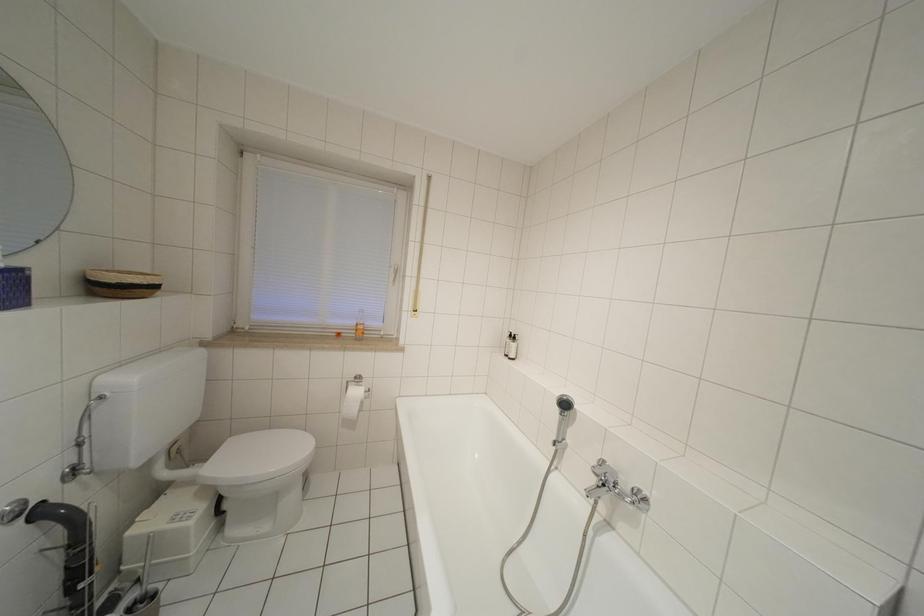
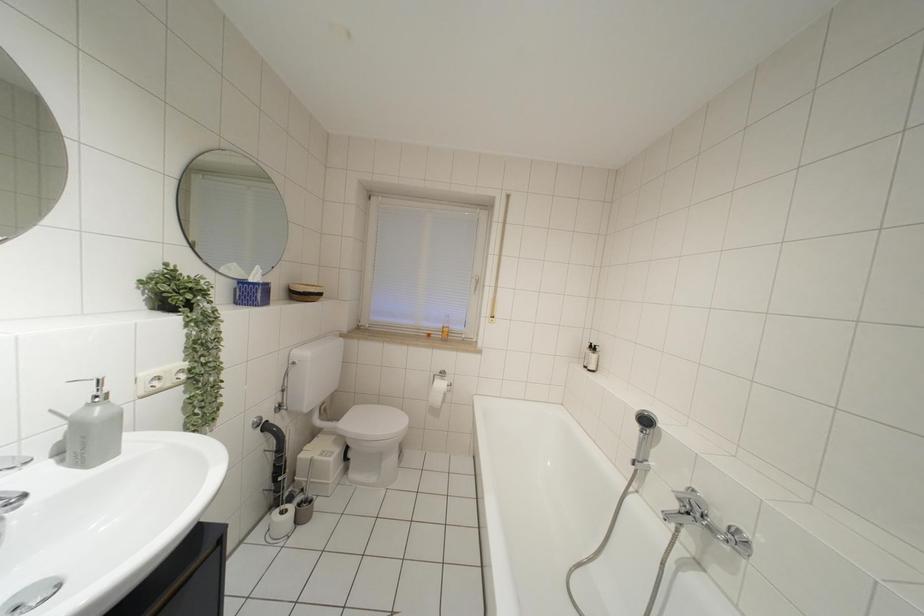
In a continuous first-person perspective shot, in which direction is the camera moving?

The movement direction of the cameraman is right, backward.